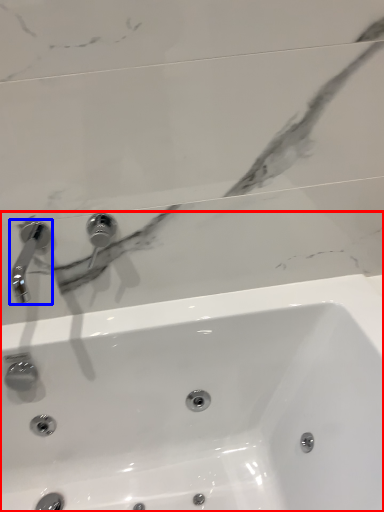
Question: Which object appears farthest to the camera in this image, sink (highlighted by a red box) or tap (highlighted by a blue box)?

Choices:
 (A) sink
 (B) tap

Answer: (B)